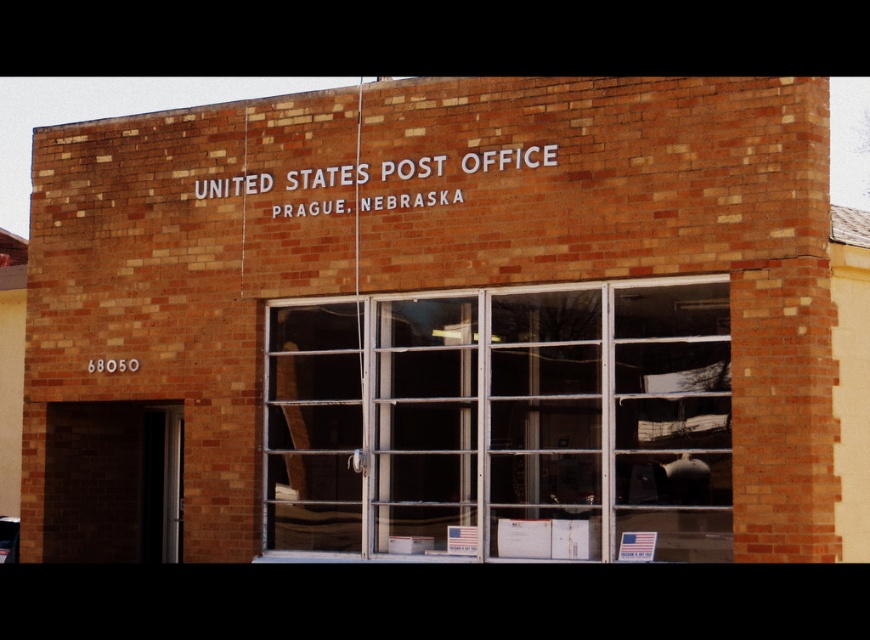
What are the coordinates of the brown brick building at center?

The brown brick building at center is located at coordinates point (437, 321).

You are a mail carrier who needs to deliver a package to the brown brick building at center. You notice a clear glass window at center. Which one is taller?

The brown brick building at center is not as tall as the clear glass window at center, so the clear glass window at center is taller.

You are a delivery person trying to find the correct entrance to the United States Post Office in Prague, Nebraska. You see the clear glass window at center and the white painted brick sign at upper center. Which object is located to the right of the other?

The clear glass window at center is positioned on the right side of white painted brick sign at upper center, so the clear glass window at center is to the right of the white painted brick sign at upper center.